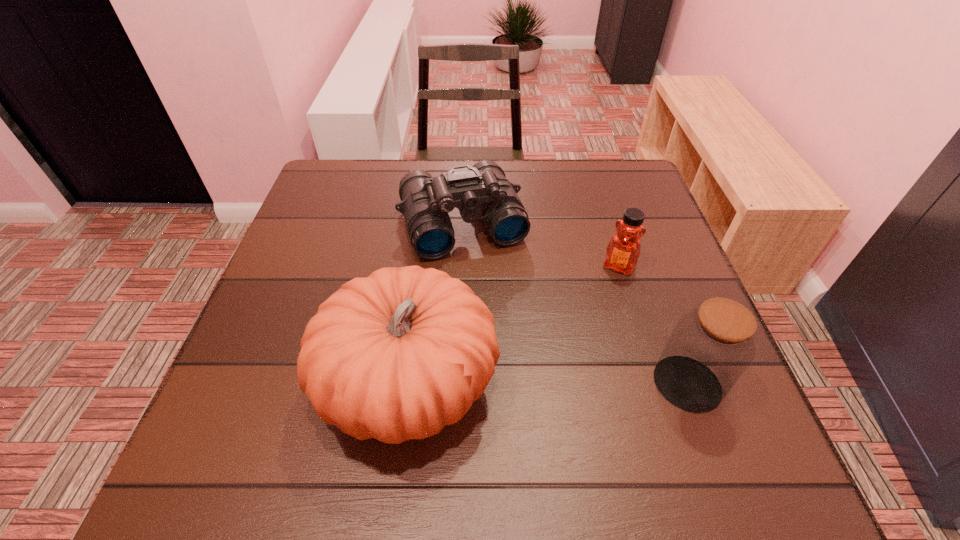
Image resolution: width=960 pixels, height=540 pixels. I want to click on free location that satisfies the following two spatial constraints: 1. on the back side of the honey; 2. on the right side of the pumpkin, so click(424, 266).

What are the coordinates of `free space in the image that satisfies the following two spatial constraints: 1. on the back side of the binoculars; 2. on the left side of the pumpkin` in the screenshot? It's located at (430, 223).